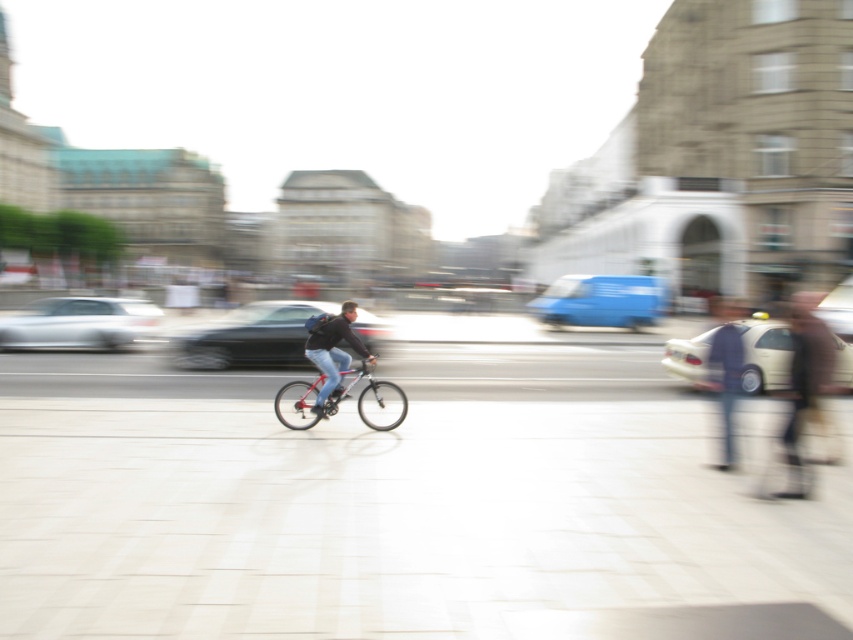
You are a delivery person who needs to quickly assess the space between the blurred beige coat at right and the metallic silver bicycle at center to determine if your package can fit. The package is 1.2 meters wide. Can the package fit between them?

The blurred beige coat at right is wider than the metallic silver bicycle at center. However, the exact distance between them isn not specified in the objects description. Therefore, it is impossible to determine if the package will fit based on the provided information.

You are a pedestrian standing on the left side of the paved area. You see the dark blue jeans at right and the matte black jacket at center. Which object is closer to your right side?

The dark blue jeans at right is closer to your right side because it is positioned to the right of the matte black jacket at center.

You are standing at the point with coordinates point [798,404] and want to walk to the point with coordinates point [244,358]. Which direction should you move in to get closer to your destination?

You should move towards the direction of the point [244,358], which is closer to you than the point [798,404]. Since point [244,358] is further to the viewer than point [798,404], you need to move forward towards it.